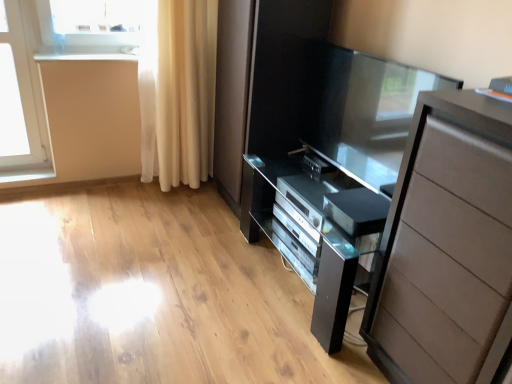
In order to click on free location in front of light beige sheer curtain at left in this screenshot , I will do `click(170, 213)`.